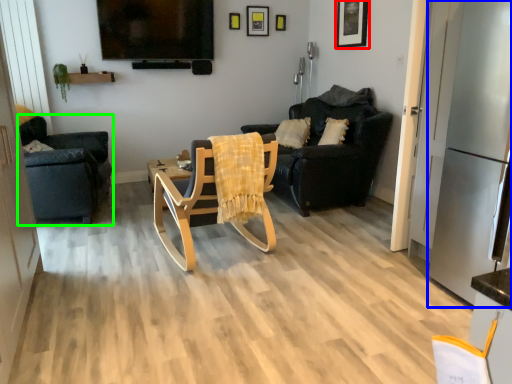
Question: Which object is positioned farthest from picture frame (highlighted by a red box)? Select from appliance (highlighted by a blue box) and chair (highlighted by a green box).

Choices:
 (A) appliance
 (B) chair

Answer: (B)